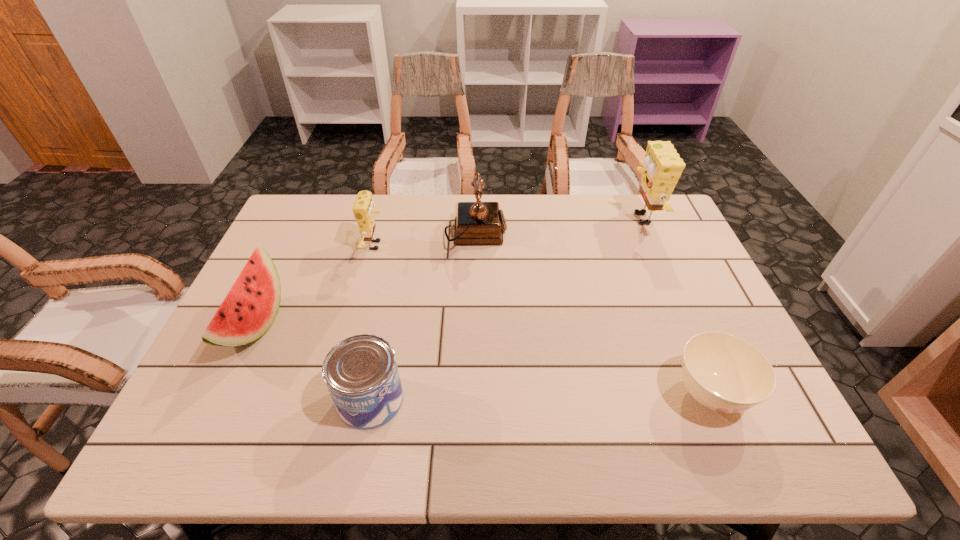
Locate an element on the screen. The width and height of the screenshot is (960, 540). free location that satisfies the following two spatial constraints: 1. on the back side of the shortest object; 2. on the outer rind of the leftmost object is located at coordinates (681, 325).

The image size is (960, 540). In order to click on vacant region that satisfies the following two spatial constraints: 1. on the dial of the third object from right to left; 2. on the right side of the sugar bowl in this screenshot , I will do `click(474, 394)`.

Locate an element on the screen. Image resolution: width=960 pixels, height=540 pixels. vacant space that satisfies the following two spatial constraints: 1. on the dial of the telephone; 2. on the left side of the sugar bowl is located at coordinates (474, 394).